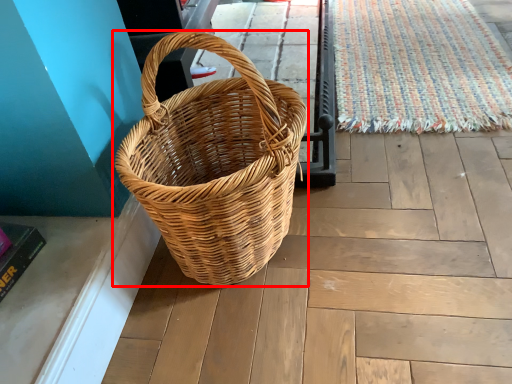
Question: From the image's perspective, where is picnic basket (annotated by the red box) located in relation to doormat in the image?

Choices:
 (A) below
 (B) above

Answer: (A)